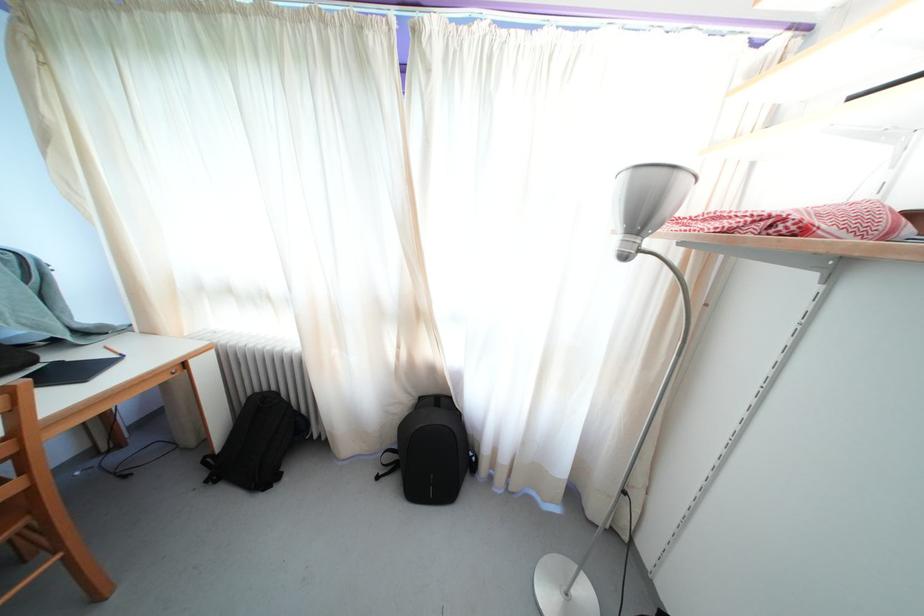
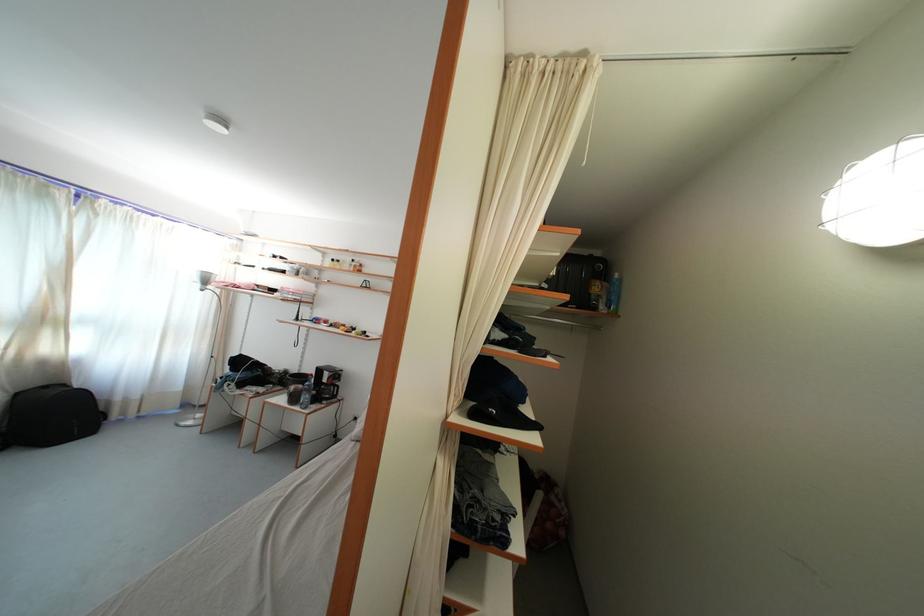
Find the pixel in the second image that matches (427,405) in the first image.

(23, 400)